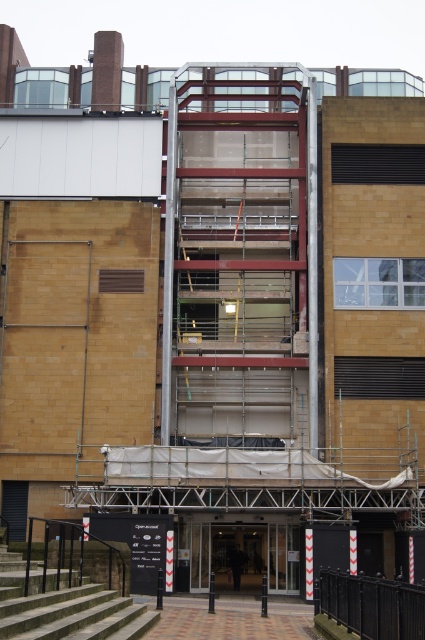
Question: Which object is the farthest from the metallic scaffolding at center?

Choices:
 (A) concrete stairs at lower left
 (B) black metal fence at lower right

Answer: (A)

Question: Estimate the real-world distances between objects in this image. Which object is closer to the black metal fence at lower right?

Choices:
 (A) concrete stairs at lower left
 (B) metallic scaffolding at center

Answer: (A)

Question: Can you confirm if concrete stairs at lower left is smaller than black metal fence at lower right?

Choices:
 (A) no
 (B) yes

Answer: (A)

Question: Among these points, which one is farthest from the camera?

Choices:
 (A) (39, 628)
 (B) (226, 324)
 (C) (339, 618)

Answer: (B)

Question: Is metallic scaffolding at center wider than black metal fence at lower right?

Choices:
 (A) yes
 (B) no

Answer: (A)

Question: Can you confirm if concrete stairs at lower left is positioned above black metal fence at lower right?

Choices:
 (A) yes
 (B) no

Answer: (A)